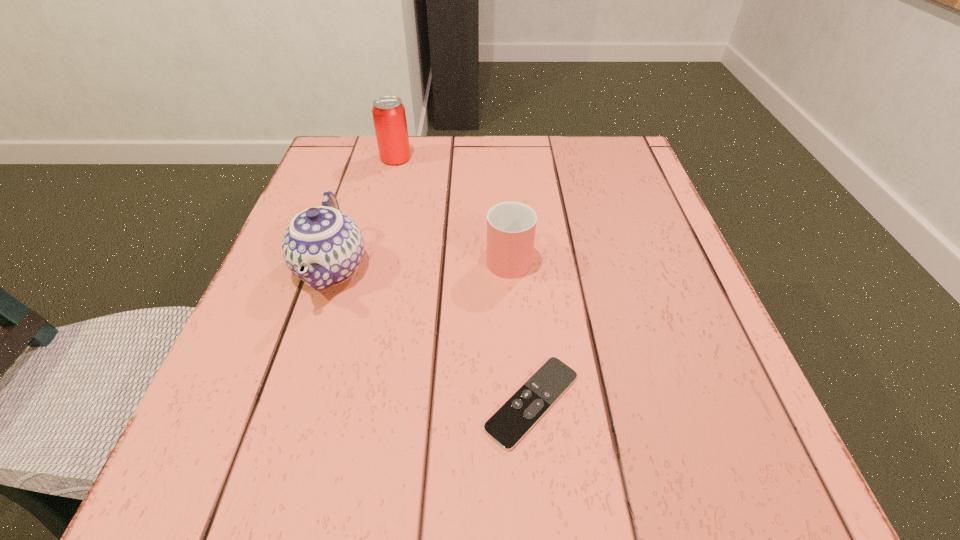
The image size is (960, 540). I want to click on vacant space located 0.050m on the front of the nearest object, so click(540, 492).

Image resolution: width=960 pixels, height=540 pixels. I want to click on object that is at the far edge, so click(x=389, y=116).

At what (x,y) coordinates should I click in order to perform the action: click on object that is at the near edge. Please return your answer as a coordinate pair (x, y). This screenshot has width=960, height=540. Looking at the image, I should click on (518, 415).

Identify the location of can at the left edge. The image size is (960, 540). (389, 116).

Identify the location of chinaware that is at the left edge. The width and height of the screenshot is (960, 540). (322, 246).

What are the coordinates of `object located at the far left corner` in the screenshot? It's located at (389, 116).

At what (x,y) coordinates should I click in order to perform the action: click on free point at the far edge. Please return your answer as a coordinate pair (x, y). Looking at the image, I should click on (515, 144).

In the image, there is a desktop. What are the coordinates of `blank space at the near edge` in the screenshot? It's located at (544, 438).

In the image, there is a desktop. At what (x,y) coordinates should I click in order to perform the action: click on free region at the left edge. Please return your answer as a coordinate pair (x, y). The width and height of the screenshot is (960, 540). Looking at the image, I should click on (279, 363).

In the image, there is a desktop. Find the location of `vacant space at the right edge`. vacant space at the right edge is located at coordinates (715, 352).